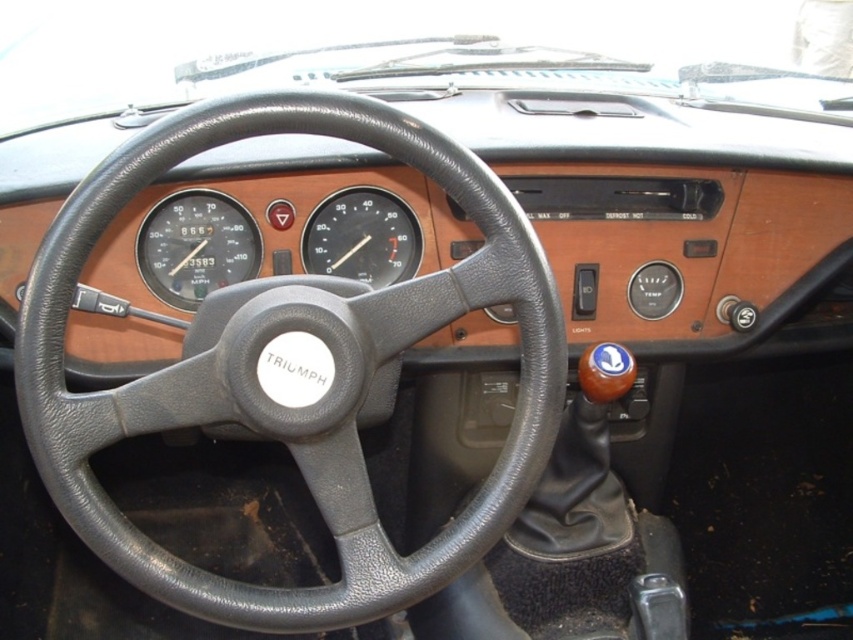
Does matte black speedometer at center have a greater height compared to black plastic speedometer at center?

Correct, matte black speedometer at center is much taller as black plastic speedometer at center.

Does point (216, 280) come behind point (344, 252)?

No, (216, 280) is closer to viewer.

Where is `matte black speedometer at center`? This screenshot has height=640, width=853. matte black speedometer at center is located at coordinates (196, 246).